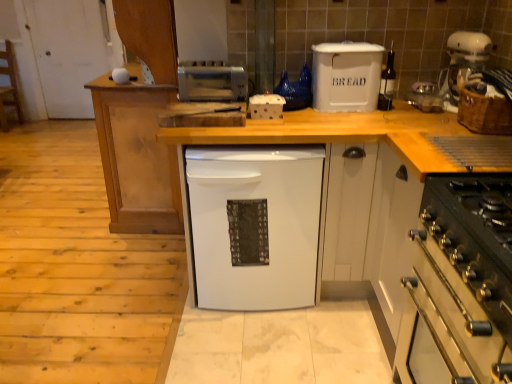
Locate an element on the screen. The width and height of the screenshot is (512, 384). empty space that is in between white plastic container at center, which is counted as the second appliance, starting from the left, and woven brown basket at right is located at coordinates (379, 124).